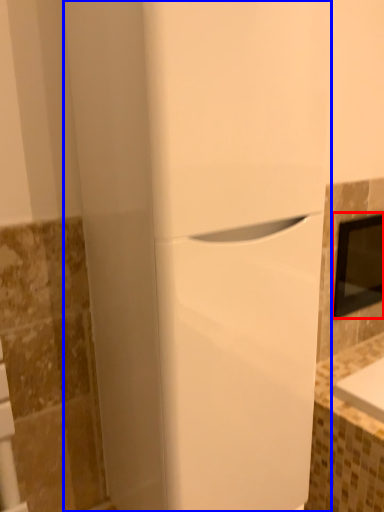
Question: Among these objects, which one is nearest to the camera, medicine cabinet (highlighted by a red box) or home appliance (highlighted by a blue box)?

Choices:
 (A) medicine cabinet
 (B) home appliance

Answer: (B)